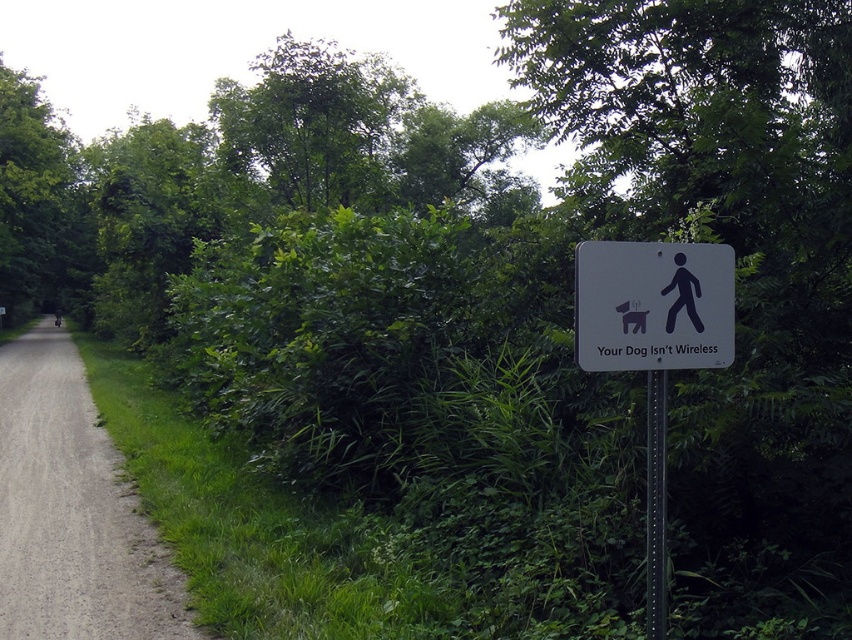
Based on the photo, who is shorter, gray gravel path at left or black plastic figure at upper center?

black plastic figure at upper center

What do you see at coordinates (72, 512) in the screenshot?
I see `gray gravel path at left` at bounding box center [72, 512].

Identify the location of gray gravel path at left. (72, 512).

You are a GUI agent. You are given a task and a screenshot of the screen. Output one action in this format:
    pyautogui.click(x=<x>, y=<y>)
    Task: Click on the gray gravel path at left
    
    Given the screenshot: What is the action you would take?
    pyautogui.click(x=72, y=512)

Is white plastic sign at center-right above black plastic figure at upper center?

Actually, white plastic sign at center-right is below black plastic figure at upper center.

Identify the location of white plastic sign at center-right. (653, 305).

Does gray gravel path at left have a greater height compared to white plastic sign at center right?

Incorrect, gray gravel path at left's height is not larger of white plastic sign at center right's.

Identify the location of gray gravel path at left. The width and height of the screenshot is (852, 640). (72, 512).

In order to click on gray gravel path at left in this screenshot , I will do `click(72, 512)`.